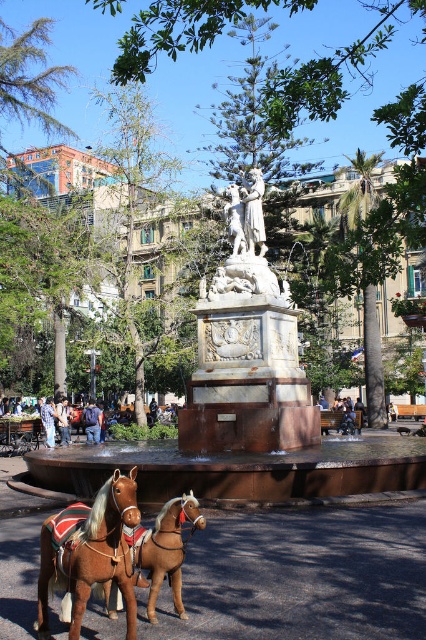
Who is positioned more to the left, white marble fountain at center or blue fabric backpack at center?

blue fabric backpack at center

Is point (319, 452) less distant than point (97, 417)?

Yes, point (319, 452) is closer to viewer.

Find the location of a particular element. white marble fountain at center is located at coordinates (242, 417).

Is brown leather horse at lower left wider than denim jacket at lower right?

No.

Looking at this image, does brown leather horse at lower left appear on the right side of denim jacket at lower right?

Correct, you'll find brown leather horse at lower left to the right of denim jacket at lower right.

Locate an element on the screen. brown leather horse at lower left is located at coordinates (89, 552).

Which of these two, brown leather horse at lower left or denim jacket at lower left, stands taller?

denim jacket at lower left

Is point (65, 560) positioned in front of point (43, 422)?

Yes, it is in front of point (43, 422).

The image size is (426, 640). I want to click on brown leather horse at lower left, so click(x=89, y=552).